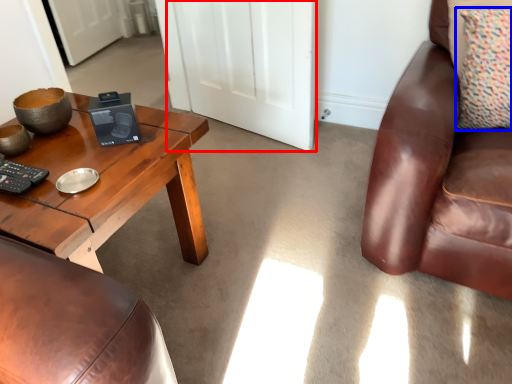
Question: Which point is further to the camera, door (highlighted by a red box) or pillow (highlighted by a blue box)?

Choices:
 (A) door
 (B) pillow

Answer: (A)